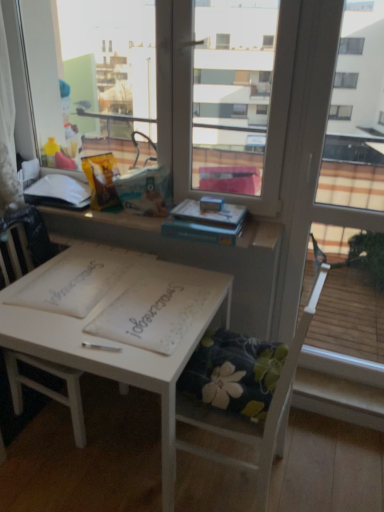
Where is `vacant space in between white paper notebook at center, which appears as the second notebook when viewed from the left, and white paper notebook at center, the 1th notebook in the left-to-right sequence`? vacant space in between white paper notebook at center, which appears as the second notebook when viewed from the left, and white paper notebook at center, the 1th notebook in the left-to-right sequence is located at coordinates coord(122,293).